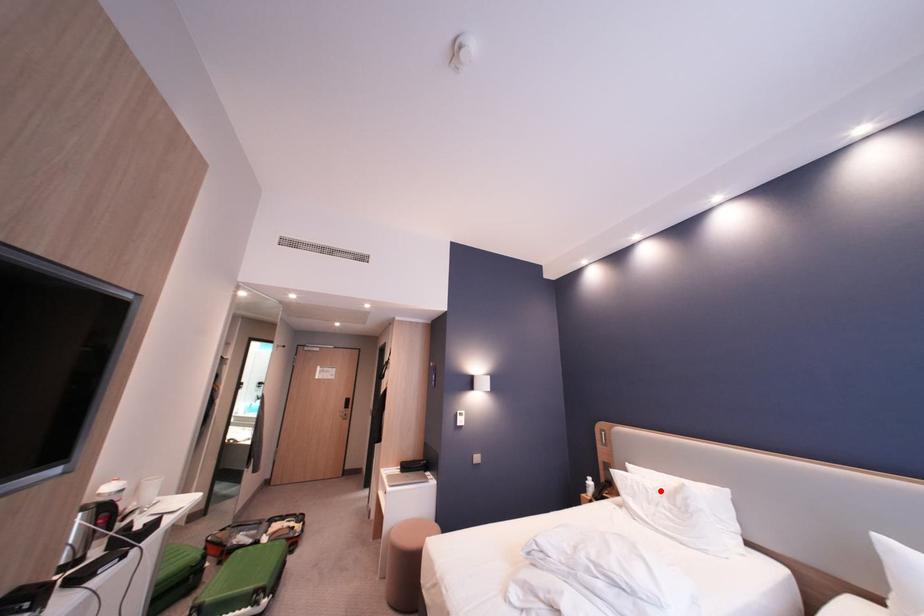
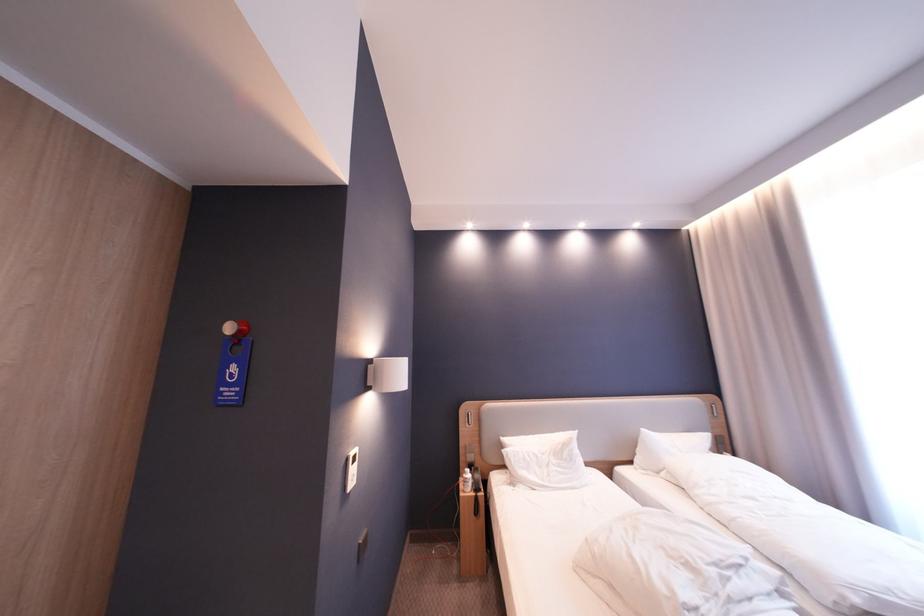
Where in the second image is the point corresponding to the highlighted location from the first image?

(550, 456)